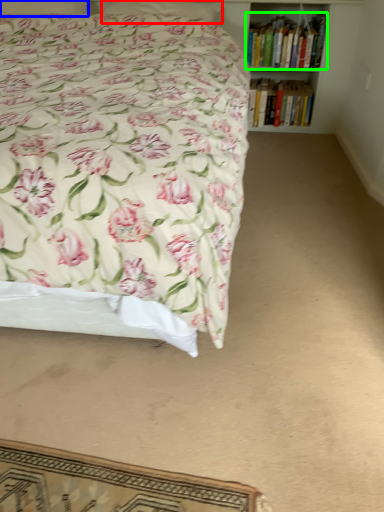
Question: Which object is the farthest from pillow (highlighted by a red box)? Choose among these: pillow (highlighted by a blue box) or book (highlighted by a green box).

Choices:
 (A) pillow
 (B) book

Answer: (B)